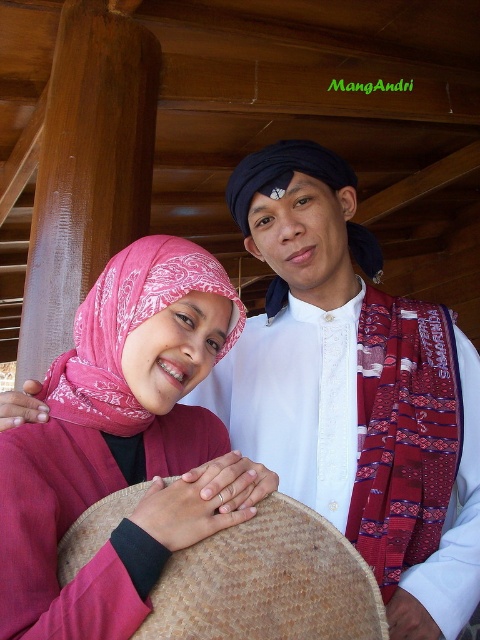
Question: Is pink fabric headscarf at center smaller than black woven turban at center?

Choices:
 (A) yes
 (B) no

Answer: (B)

Question: Can you confirm if pink fabric headscarf at center is positioned to the left of brown woven straw hat at center?

Choices:
 (A) yes
 (B) no

Answer: (A)

Question: Which point appears farthest from the camera in this image?

Choices:
 (A) (93, 541)
 (B) (93, 392)
 (C) (439, 435)
 (D) (130, 323)

Answer: (C)

Question: Among these objects, which one is farthest from the camera?

Choices:
 (A) black woven turban at center
 (B) brown woven straw hat at center

Answer: (A)

Question: Which of the following is the closest to the observer?

Choices:
 (A) pink fabric headscarf at upper left
 (B) bright red woven shawl at center

Answer: (A)

Question: Is the position of bright red woven shawl at center more distant than that of pink fabric headscarf at upper left?

Choices:
 (A) yes
 (B) no

Answer: (A)